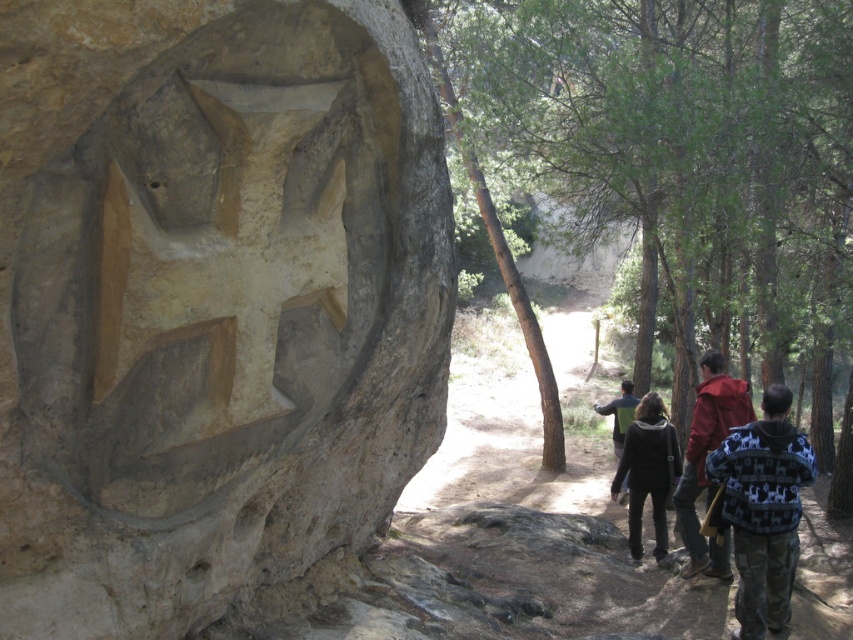
Is natural stone carving at center bigger than green leafy tree at center?

Actually, natural stone carving at center might be smaller than green leafy tree at center.

Is point (445, 305) farther from camera compared to point (703, 192)?

No, (445, 305) is closer to viewer.

The width and height of the screenshot is (853, 640). I want to click on natural stone carving at center, so click(x=209, y=300).

Can you confirm if green leafy tree at center is positioned to the left of red fleece jacket at right?

Incorrect, green leafy tree at center is not on the left side of red fleece jacket at right.

Does green leafy tree at center have a larger size compared to red fleece jacket at right?

Yes.

Find the location of `green leafy tree at center`. green leafy tree at center is located at coordinates (685, 161).

Is green leafy tree at center taller than knitted sweater at right?

Yes.

Between green leafy tree at center and knitted sweater at right, which one has more height?

green leafy tree at center

This screenshot has height=640, width=853. Describe the element at coordinates (685, 161) in the screenshot. I see `green leafy tree at center` at that location.

This screenshot has width=853, height=640. Find the location of `green leafy tree at center`. green leafy tree at center is located at coordinates (685, 161).